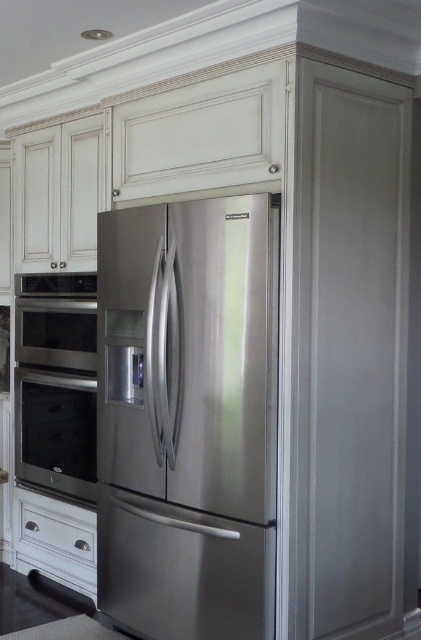
Question: Can you confirm if stainless steel oven at left is positioned to the left of matte white drawer at lower center?

Choices:
 (A) no
 (B) yes

Answer: (B)

Question: Is white wood drawer at lower left above matte white drawer at lower center?

Choices:
 (A) yes
 (B) no

Answer: (B)

Question: Based on their relative distances, which object is nearer to the stainless steel refrigerator at center?

Choices:
 (A) stainless steel oven at left
 (B) white wood drawer at lower left
 (C) matte white drawer at lower center

Answer: (A)

Question: Among these points, which one is farthest from the camera?

Choices:
 (A) (66, 532)
 (B) (23, 541)
 (C) (133, 433)

Answer: (B)

Question: Does stainless steel refrigerator at center have a lesser width compared to stainless steel oven at left?

Choices:
 (A) no
 (B) yes

Answer: (A)

Question: Which point is closer to the camera?

Choices:
 (A) white wood drawer at lower left
 (B) stainless steel oven at left
 (C) stainless steel refrigerator at center

Answer: (C)